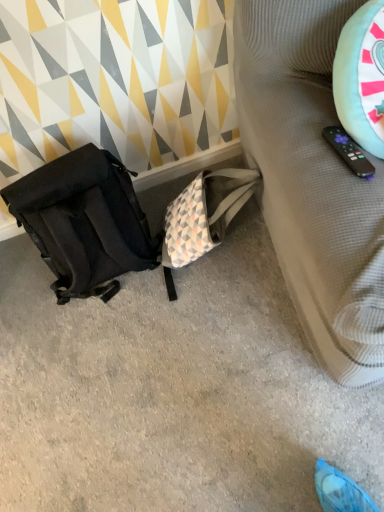
Question: In the image, is black fabric backpack at left on the left side or the right side of textured beige sofa at right?

Choices:
 (A) right
 (B) left

Answer: (B)

Question: Considering the positions of point (203, 264) and point (274, 109), is point (203, 264) closer or farther from the camera than point (274, 109)?

Choices:
 (A) closer
 (B) farther

Answer: (B)

Question: Based on their relative distances, which object is nearer to the black fabric backpack at left?

Choices:
 (A) matte black backpack at left
 (B) textured beige sofa at right

Answer: (A)

Question: Which is farther from the matte black backpack at left?

Choices:
 (A) black fabric backpack at left
 (B) textured beige sofa at right

Answer: (B)